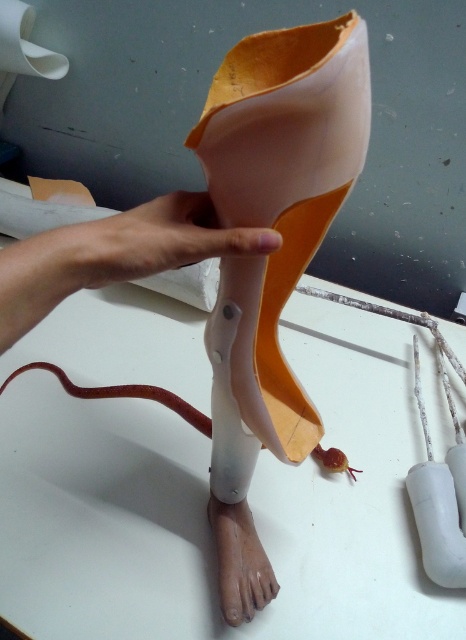
You are a physical therapist examining a prosthetic leg. You notice the smooth skin hand at center and the matte plastic foot at lower center. Which object is located above the other?

The smooth skin hand at center is positioned over the matte plastic foot at lower center, meaning it is above the foot.

You are a physical therapist helping a patient choose between two prosthetic options. The first option is the matte plastic leg at center, and the second is the smooth skin hand at center. Which one is more suitable for someone needing a prosthetic limb?

The matte plastic leg at center is larger in size than the smooth skin hand at center, so it is more suitable for someone needing a prosthetic limb as it is designed to replace a leg, which typically requires a larger prosthetic compared to a hand.

You are a physical therapist helping a patient adjust their prosthetic leg. The prosthetic has a matte plastic leg at center being held by a smooth skin hand at center. Can you determine if there is enough space between the hand and the prosthetic to comfortably grip and adjust it?

The matte plastic leg at center and smooth skin hand at center are 0.36 inches apart from each other. This distance is very small, so it might be difficult to comfortably grip and adjust the prosthetic leg without moving the hand closer or farther away.